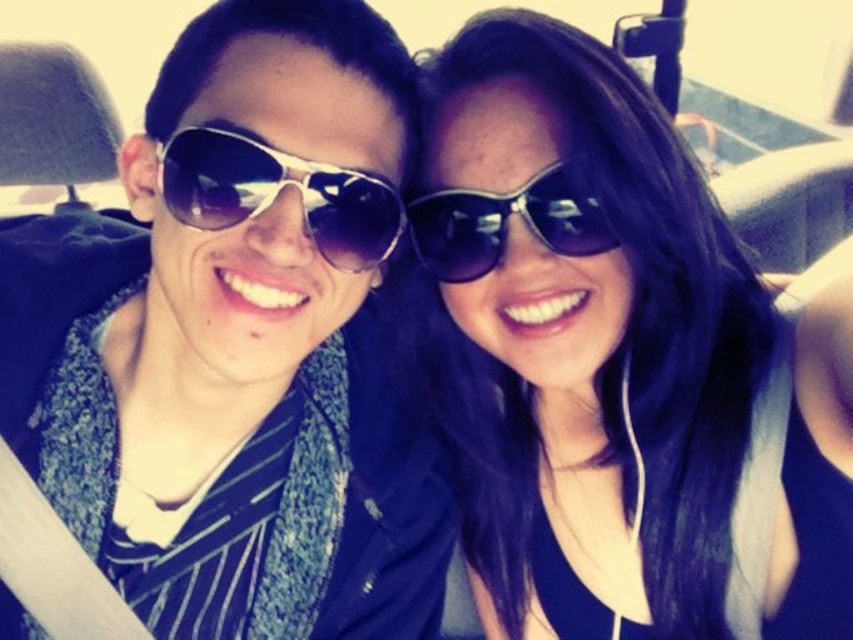
You are a photographer trying to capture the metallic aviator sunglasses at left in your frame. The camera you are using has a focus point at coordinate 0.5, 0.3. Will the sunglasses be in focus?

The metallic aviator sunglasses at left is located at point (236,342), which is close to the focus point at (254,320). Therefore, the sunglasses will likely be in focus.

You are a photographer trying to capture a closeup shot of both the metallic aviator sunglasses at left and the metallic reflective sunglasses at center. Given that your camera can only focus on objects within 15 centimeters of each other, will you be able to take the photo successfully?

The distance between the metallic aviator sunglasses at left and the metallic reflective sunglasses at center is 17.04 centimeters, which exceeds the camera focus range of 15 centimeters. Therefore, the camera cannot focus on both simultaneously, making it impossible to take the photo successfully.